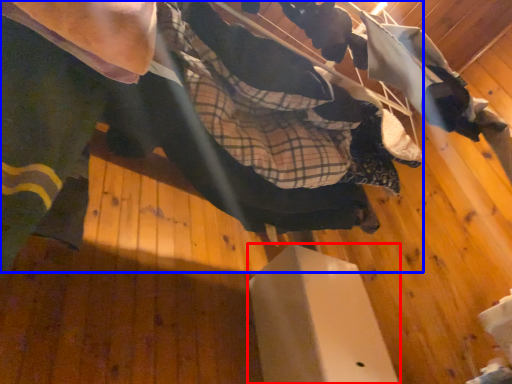
Question: Which object is further to the camera taking this photo, furniture (highlighted by a red box) or skateboarder (highlighted by a blue box)?

Choices:
 (A) furniture
 (B) skateboarder

Answer: (A)